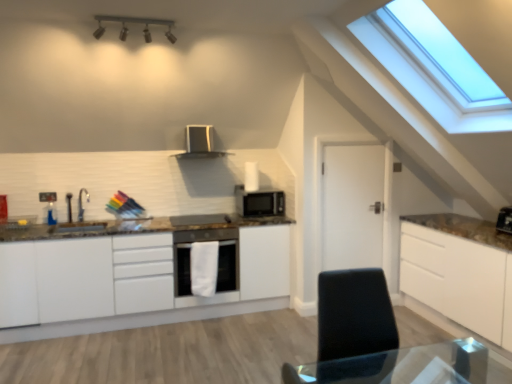
Question: From the image's perspective, relative to metallic track lighting at upper center, is white matte door at center above or below?

Choices:
 (A) above
 (B) below

Answer: (B)

Question: Is white matte door at center inside or outside of metallic track lighting at upper center?

Choices:
 (A) outside
 (B) inside

Answer: (A)

Question: Estimate the real-world distances between objects in this image. Which object is farther from the metallic track lighting at upper center?

Choices:
 (A) white glossy oven at center
 (B) white matte door at center
 (C) satin silver microwave at center
 (D) satin silver microwave at upper center
 (E) satin black microwave at center

Answer: (B)

Question: Estimate the real-world distances between objects in this image. Which object is closer to the metallic track lighting at upper center?

Choices:
 (A) white matte door at center
 (B) satin black microwave at center
 (C) white matte cabinet at center
 (D) satin silver microwave at center
 (E) satin silver microwave at upper center

Answer: (E)